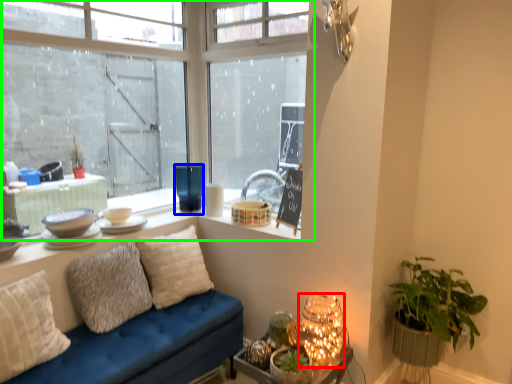
Question: Estimate the real-world distances between objects in this image. Which object is closer to table (highlighted by a red box), candle holder (highlighted by a blue box) or window (highlighted by a green box)?

Choices:
 (A) candle holder
 (B) window

Answer: (A)